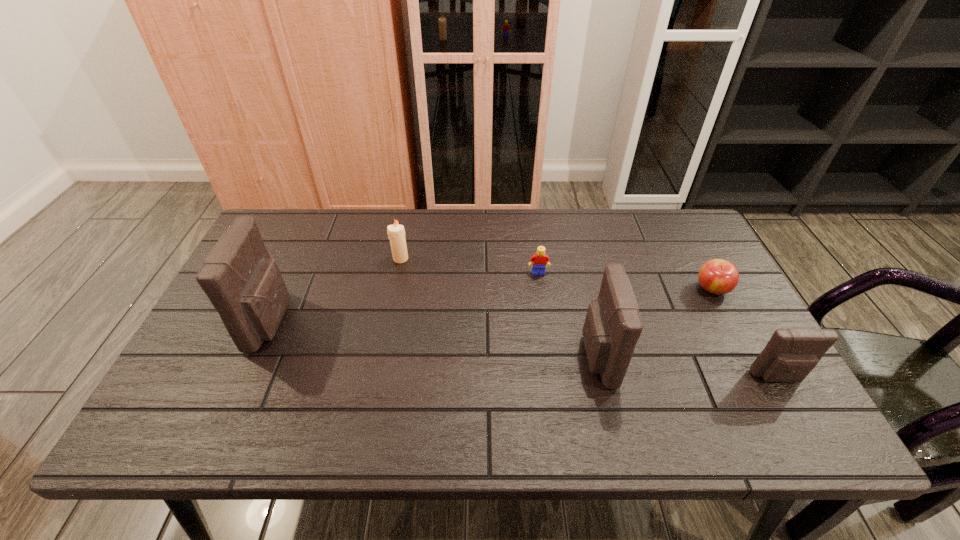
The height and width of the screenshot is (540, 960). I want to click on vacant space situated with an open flap on the fifth shortest object, so click(x=432, y=357).

You are a GUI agent. You are given a task and a screenshot of the screen. Output one action in this format:
    pyautogui.click(x=<x>, y=<y>)
    Task: Click on the free point located 0.290m with an open flap on the fifth shortest object
    Image resolution: width=960 pixels, height=540 pixels.
    Given the screenshot: What is the action you would take?
    pyautogui.click(x=461, y=357)

I want to click on vacant space located 0.210m with an open flap on the fifth shortest object, so click(x=494, y=357).

Where is `vacant area situated 0.230m on the face of the fifth nearest object`? This screenshot has width=960, height=540. vacant area situated 0.230m on the face of the fifth nearest object is located at coordinates (547, 339).

Find the location of a particular element. The image size is (960, 540). free spot located 0.050m on the back of the apple is located at coordinates (700, 265).

This screenshot has width=960, height=540. Identify the location of vacant area located on the right of the farthest object. (443, 259).

You are a GUI agent. You are given a task and a screenshot of the screen. Output one action in this format:
    pyautogui.click(x=<x>, y=<y>)
    Task: Click on the object positioned at the far edge
    The height and width of the screenshot is (540, 960).
    Given the screenshot: What is the action you would take?
    pyautogui.click(x=396, y=233)

I want to click on object at the left edge, so click(x=245, y=286).

Where is `pouch that is at the right edge`? The width and height of the screenshot is (960, 540). pouch that is at the right edge is located at coordinates (791, 354).

The height and width of the screenshot is (540, 960). What are the coordinates of `apple at the right edge` in the screenshot? It's located at (717, 276).